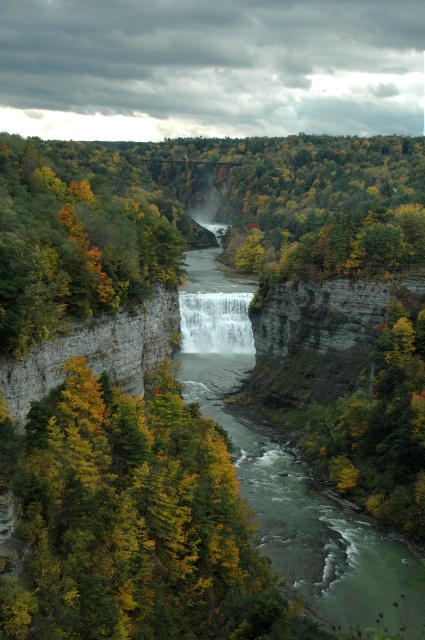
Is point (209, 372) positioned behind point (227, 328)?

No, (209, 372) is in front of (227, 328).

Is green smooth river at center smaller than white frothy water at center?

Incorrect, green smooth river at center is not smaller in size than white frothy water at center.

Locate an element on the screen. This screenshot has width=425, height=640. green smooth river at center is located at coordinates (274, 486).

Can you confirm if gray rocky cliff at center is shorter than white frothy water at center?

Yes, gray rocky cliff at center is shorter than white frothy water at center.

Who is positioned more to the left, gray rocky cliff at center or white frothy water at center?

gray rocky cliff at center

Does point (169, 304) come farther from viewer compared to point (203, 333)?

No, it is not.

The height and width of the screenshot is (640, 425). Identify the location of gray rocky cliff at center. (96, 352).

Is green leafy tree at left taller than green leafy tree at right?

Yes.

Between point (65, 317) and point (377, 420), which one is positioned behind?

The point (377, 420) is more distant.

Locate an element on the screen. green leafy tree at left is located at coordinates (76, 236).

At what (x,y) coordinates should I click in order to perform the action: click on green leafy tree at left. Please return your answer as a coordinate pair (x, y). The image size is (425, 640). Looking at the image, I should click on pyautogui.click(x=76, y=236).